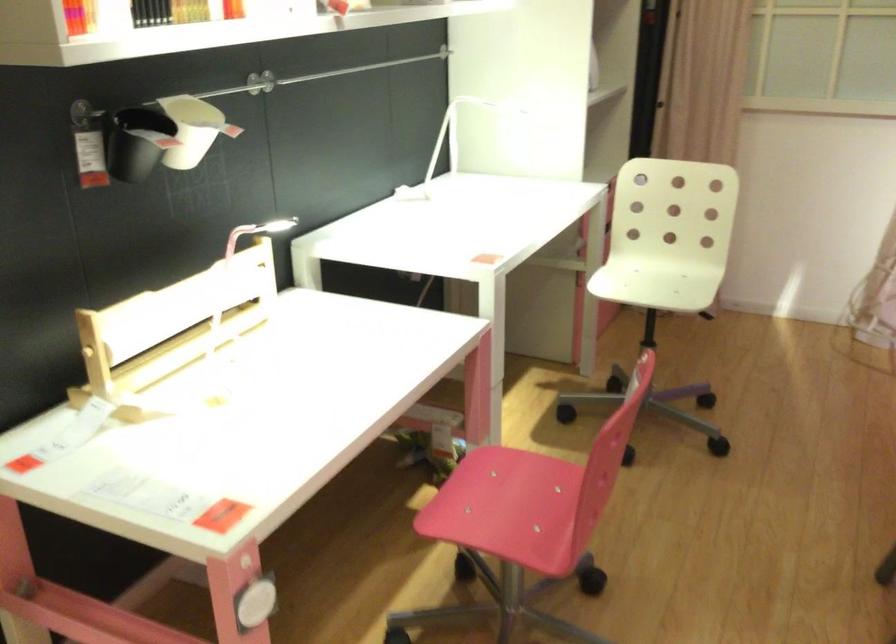
Identify the location of white lamp head. The height and width of the screenshot is (644, 896). tap(451, 142).